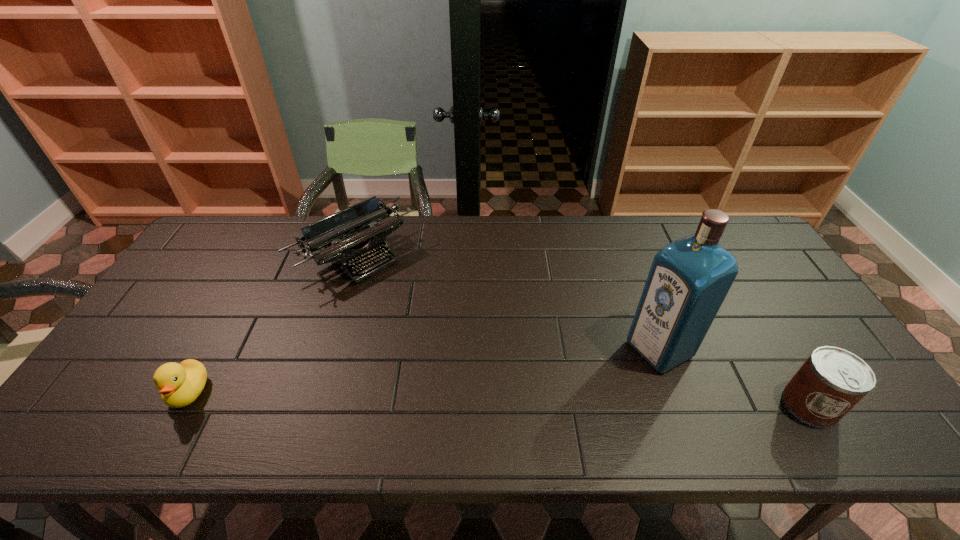
Locate an element on the screen. The height and width of the screenshot is (540, 960). vacant point located between the second object from right to left and the typewriter is located at coordinates (508, 302).

Identify the location of free spot between the typewriter and the can. (584, 330).

Image resolution: width=960 pixels, height=540 pixels. Identify the location of vacant space in between the leftmost object and the liquor. (424, 370).

Identify the location of free spot between the can and the duckling. The width and height of the screenshot is (960, 540). (499, 399).

Where is `vacant area that lies between the liquor and the rightmost object`? Image resolution: width=960 pixels, height=540 pixels. vacant area that lies between the liquor and the rightmost object is located at coordinates (734, 377).

Image resolution: width=960 pixels, height=540 pixels. Identify the location of vacant space in between the tallest object and the duckling. (424, 370).

Where is `free space that is in between the leftmost object and the second object from right to left`? free space that is in between the leftmost object and the second object from right to left is located at coordinates (424, 370).

This screenshot has width=960, height=540. What are the coordinates of `the second closest object to the shortest object` in the screenshot? It's located at (689, 278).

You are a GUI agent. You are given a task and a screenshot of the screen. Output one action in this format:
    pyautogui.click(x=<x>, y=<y>)
    Task: Click on the closest object to the farthest object
    
    Given the screenshot: What is the action you would take?
    pyautogui.click(x=180, y=384)

The width and height of the screenshot is (960, 540). What are the coordinates of `free space that satisfies the following two spatial constraints: 1. on the face of the can; 2. on the right side of the duckling` in the screenshot? It's located at (x=181, y=405).